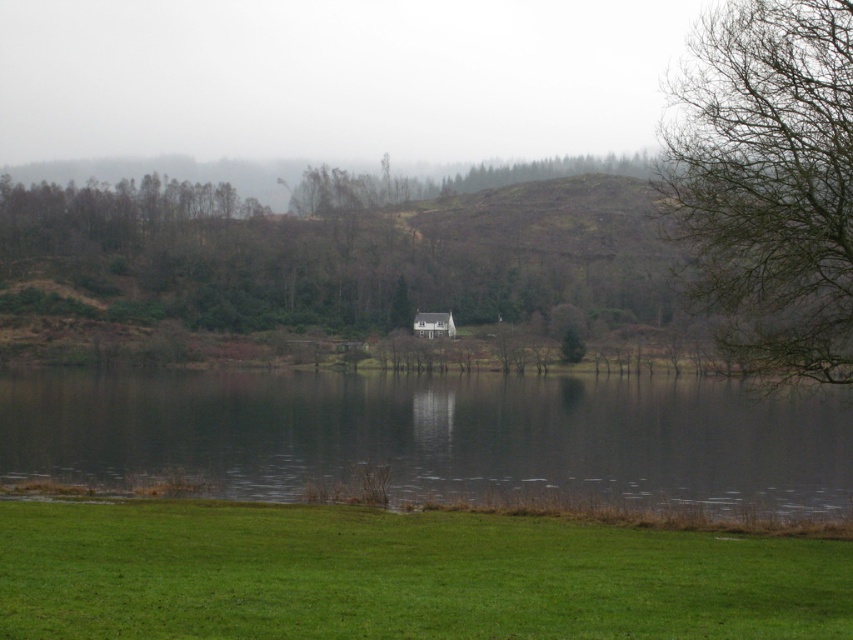
You are standing at the edge of the water and want to walk to the white wooden hut at center. Which direction should you head relative to the dark reflective water at center?

You should head to the left of the dark reflective water at center to reach the white wooden hut at center because the dark reflective water at center is to the right of the white wooden hut at center.